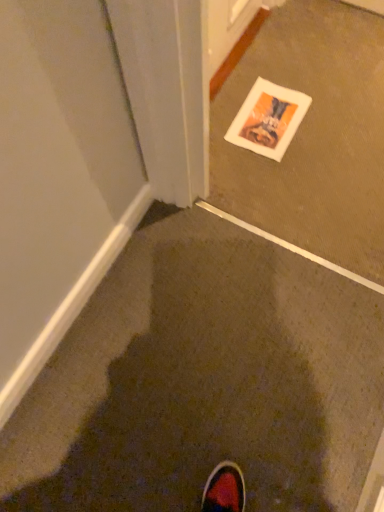
Question: Is white paper at center in front of or behind brown matte carpet at center in the image?

Choices:
 (A) behind
 (B) front

Answer: (A)

Question: Considering the positions of point (332, 202) and point (193, 371), is point (332, 202) closer or farther from the camera than point (193, 371)?

Choices:
 (A) closer
 (B) farther

Answer: (B)

Question: Is white paper at center to the left or to the right of brown matte carpet at center in the image?

Choices:
 (A) right
 (B) left

Answer: (A)

Question: From a real-world perspective, relative to white paper at center, is brown matte carpet at center vertically above or below?

Choices:
 (A) below
 (B) above

Answer: (A)

Question: Is brown matte carpet at center wider or thinner than white paper at center?

Choices:
 (A) thin
 (B) wide

Answer: (A)

Question: In terms of height, does brown matte carpet at center look taller or shorter compared to white paper at center?

Choices:
 (A) short
 (B) tall

Answer: (A)

Question: Is point (155, 437) closer or farther from the camera than point (301, 223)?

Choices:
 (A) closer
 (B) farther

Answer: (A)